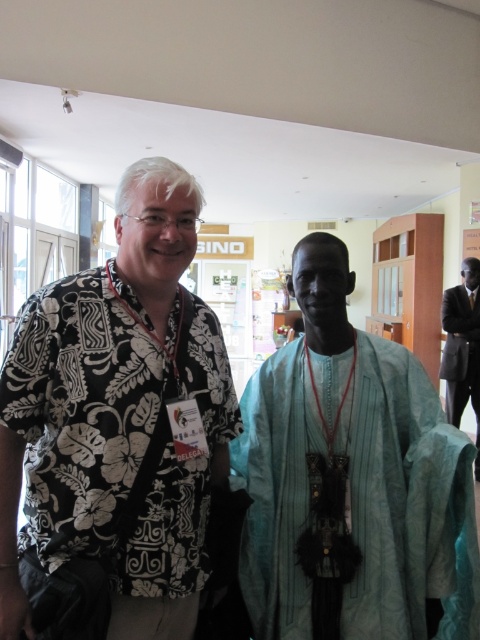
You are a photographer at an event and need to adjust the lighting so that the black floral shirt at left and the light blue fabric robe at center are both visible. Which object should you focus on first to ensure proper exposure?

The black floral shirt at left is above the light blue fabric robe at center, so focusing on the light blue fabric robe at center first would help balance the exposure since it is closer to the camera.

You are standing 50 inches away from the image. Is the point at coordinates point [56,598] closer to you than your current position?

The distance of point [56,598] from viewer is 38.69 inches, so yes, the point is closer to you than your current position of 50 inches away.

You are organizing a photo shoot and need to place two outfits on a mannequin stand. The stand has a maximum width capacity of 1.2 meters. Given the light blue fabric robe at center and the black suit at right, can both outfits be displayed on the stand simultaneously without exceeding the width limit?

The light blue fabric robe at center has a larger width than the black suit at right. However, since the exact widths are not provided, it is uncertain if their combined width exceeds the stand capacity. Please check the individual measurements.